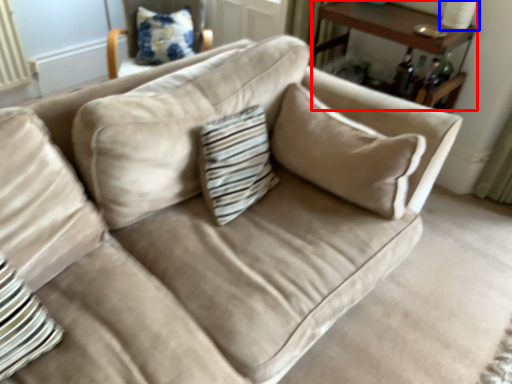
Question: Which object appears closest to the camera in this image, table (highlighted by a red box) or table lamp (highlighted by a blue box)?

Choices:
 (A) table
 (B) table lamp

Answer: (A)